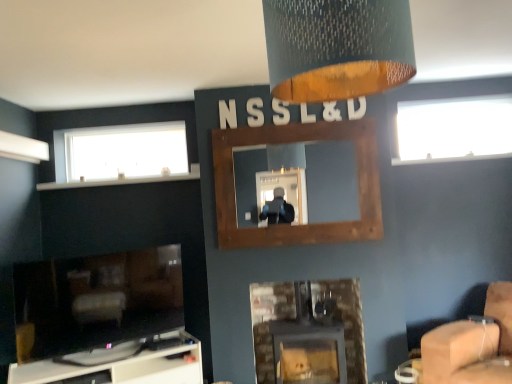
Question: Is matte black fireplace at lower left, marked as the third fireplace in a right-to-left arrangement, wider or thinner than transparent glass window at upper right, the 2th window viewed from the left?

Choices:
 (A) thin
 (B) wide

Answer: (B)

Question: From their relative heights in the image, would you say matte black fireplace at lower left, which appears as the 1th fireplace when viewed from the left, is taller or shorter than transparent glass window at upper right, the 2th window viewed from the left?

Choices:
 (A) tall
 (B) short

Answer: (A)

Question: Which object is positioned farthest from the rustic wood fireplace at center, marked as the 2th fireplace in a left-to-right arrangement?

Choices:
 (A) matte black fireplace at lower left, which appears as the 1th fireplace when viewed from the left
 (B) textured fabric lampshade at upper center
 (C) beige fabric swivel chair at lower right
 (D) white glossy tv stand at lower left
 (E) transparent glass window at upper right, the first window from the right

Answer: (B)

Question: Based on their relative distances, which object is farther from the white frosted glass window at upper left, the first window positioned from the left?

Choices:
 (A) white plastic mantle at upper left
 (B) transparent glass window at upper right, the 2th window viewed from the left
 (C) beige fabric swivel chair at lower right
 (D) rustic wood fireplace at center, the 2th fireplace positioned from the right
 (E) matte black fireplace at lower left, marked as the third fireplace in a right-to-left arrangement

Answer: (C)